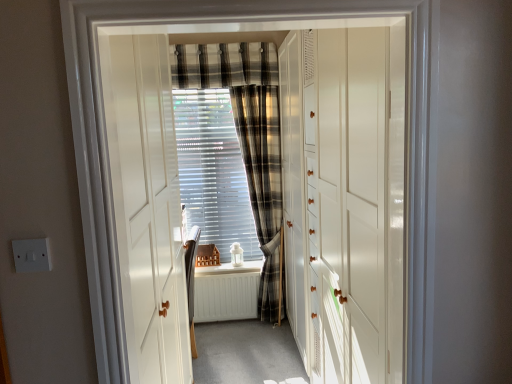
The height and width of the screenshot is (384, 512). What are the coordinates of `free spot in front of white matte radiator at center` in the screenshot? It's located at (230, 343).